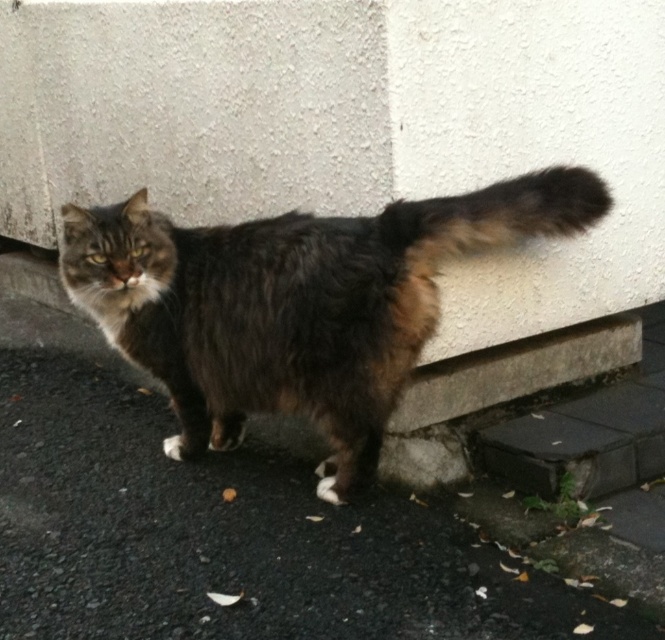
Is dark asphalt pavement at lower center positioned at the back of fuzzy brown cat at center?

That is False.

What do you see at coordinates (231, 538) in the screenshot? This screenshot has height=640, width=665. I see `dark asphalt pavement at lower center` at bounding box center [231, 538].

Is point (192, 516) positioned in front of point (253, 296)?

That is False.

Locate an element on the screen. This screenshot has width=665, height=640. dark asphalt pavement at lower center is located at coordinates (231, 538).

Is point (436, 554) positioned in front of point (563, 188)?

Yes, point (436, 554) is closer to viewer.

Looking at this image, is dark asphalt pavement at lower center positioned behind fuzzy brown tail at upper right?

No, dark asphalt pavement at lower center is closer to the viewer.

Does point (211, 612) lie behind point (521, 179)?

No.

Image resolution: width=665 pixels, height=640 pixels. I want to click on dark asphalt pavement at lower center, so click(x=231, y=538).

Can you confirm if fuzzy brown cat at center is positioned above fuzzy brown tail at upper right?

Incorrect, fuzzy brown cat at center is not positioned above fuzzy brown tail at upper right.

Does fuzzy brown cat at center have a greater height compared to fuzzy brown tail at upper right?

Indeed, fuzzy brown cat at center has a greater height compared to fuzzy brown tail at upper right.

Measure the distance between fuzzy brown cat at center and camera.

fuzzy brown cat at center and camera are 2.10 meters apart.

The height and width of the screenshot is (640, 665). Find the location of `fuzzy brown cat at center`. fuzzy brown cat at center is located at coordinates (297, 305).